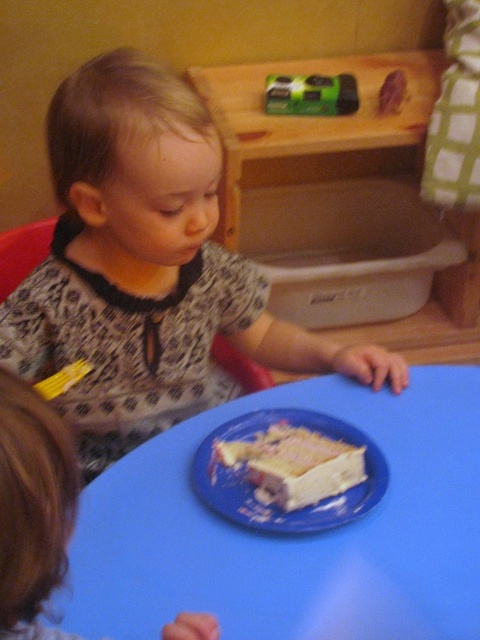
Does matte black shirt at upper left come in front of smooth brown hair at lower left?

No, it is not.

Is matte black shirt at upper left wider than smooth brown hair at lower left?

Indeed, matte black shirt at upper left has a greater width compared to smooth brown hair at lower left.

Is point (122, 369) farther from viewer compared to point (51, 516)?

Yes, it is.

Locate an element on the screen. The width and height of the screenshot is (480, 640). matte black shirt at upper left is located at coordinates (146, 268).

Which is above, blue plastic table at center or smooth brown hair at lower left?

Positioned higher is smooth brown hair at lower left.

Is point (472, 618) positioned behind point (10, 449)?

Yes, it is behind point (10, 449).

Is point (338, 563) farther from camera compared to point (3, 390)?

Yes, it is behind point (3, 390).

Identify the location of blue plastic table at center. (294, 538).

Does smooth brown hair at lower left appear on the right side of white frosted cake at center?

Incorrect, smooth brown hair at lower left is not on the right side of white frosted cake at center.

Between smooth brown hair at lower left and white frosted cake at center, which one is positioned higher?

white frosted cake at center is above.

At what (x,y) coordinates should I click in order to perform the action: click on smooth brown hair at lower left. Please return your answer as a coordinate pair (x, y). This screenshot has height=640, width=480. Looking at the image, I should click on (33, 502).